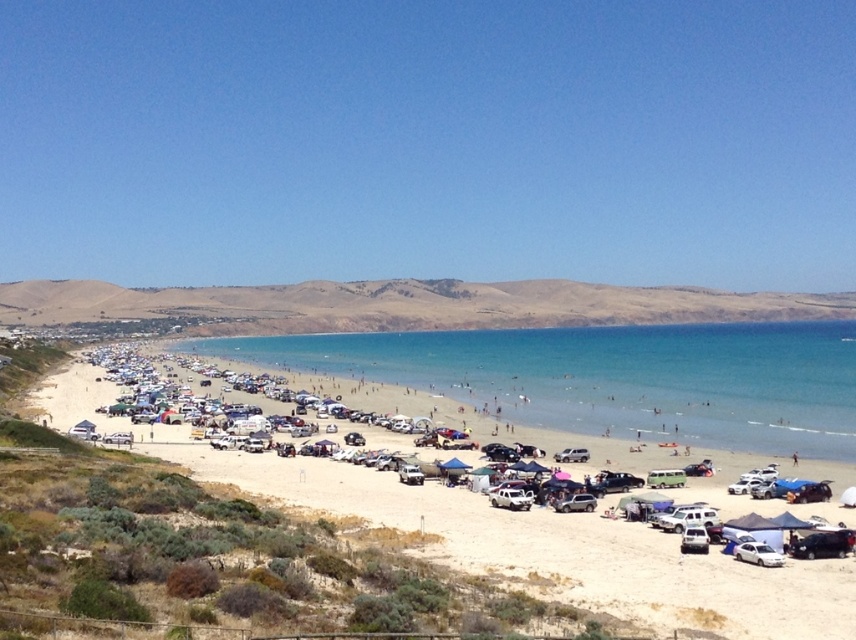
Can you confirm if brown/dry grassy hillside at upper center is positioned to the left of white matte car at lower right?

No, brown/dry grassy hillside at upper center is not to the left of white matte car at lower right.

Between point (343, 324) and point (768, 550), which one is positioned behind?

Point (343, 324)

Is point (409, 280) less distant than point (741, 557)?

No, (409, 280) is further to viewer.

What are the coordinates of `brown/dry grassy hillside at upper center` in the screenshot? It's located at (400, 305).

Which is behind, point (498, 548) or point (503, 500)?

The point (503, 500) is behind.

Does white sand beach at lower center have a lesser height compared to white matte car at center?

Incorrect, white sand beach at lower center's height does not fall short of white matte car at center's.

Describe the element at coordinates (509, 532) in the screenshot. This screenshot has height=640, width=856. I see `white sand beach at lower center` at that location.

Image resolution: width=856 pixels, height=640 pixels. In order to click on white sand beach at lower center in this screenshot , I will do `click(509, 532)`.

Between white sand beach at lower center and white matte car at lower right, which one is positioned lower?

white sand beach at lower center is below.

Is point (73, 417) farther from viewer compared to point (774, 560)?

Yes.

Is point (126, 420) closer to viewer compared to point (768, 547)?

No, it is not.

Find the location of a particular element. white sand beach at lower center is located at coordinates (509, 532).